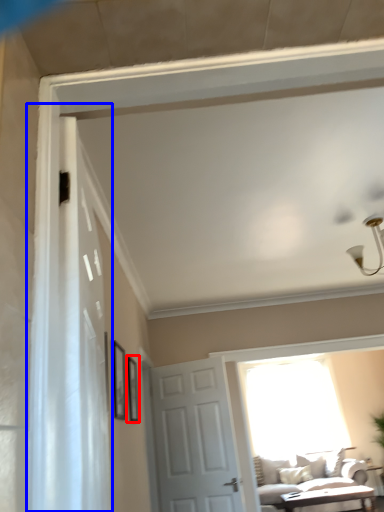
Question: Which point is further to the camera, picture frame (highlighted by a red box) or shower curtain (highlighted by a blue box)?

Choices:
 (A) picture frame
 (B) shower curtain

Answer: (A)